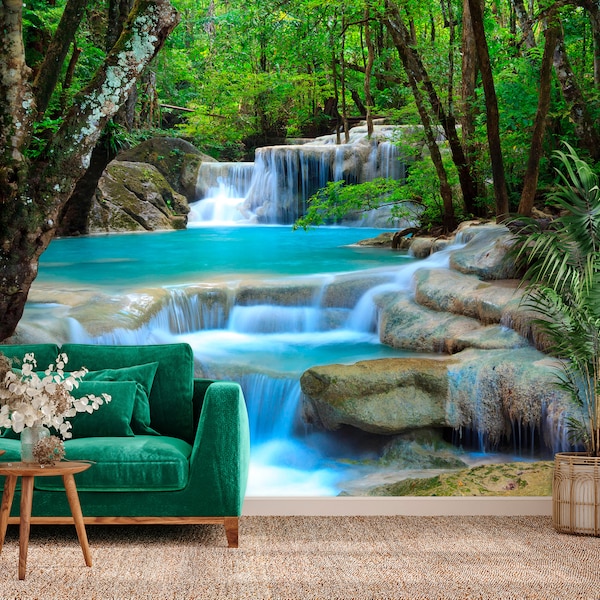
Identify the location of couch arm. This screenshot has height=600, width=600. (220, 420).